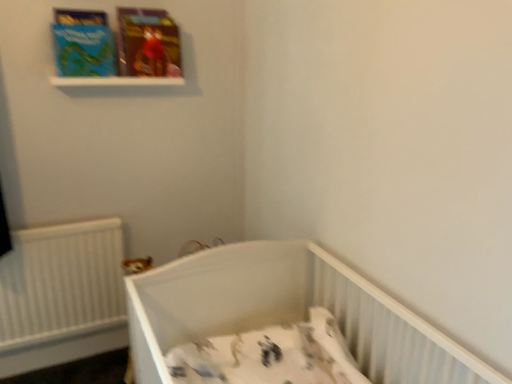
The image size is (512, 384). What do you see at coordinates (83, 43) in the screenshot?
I see `matte blue paperback book at upper left, which is counted as the 1th paperback book, starting from the left` at bounding box center [83, 43].

You are a GUI agent. You are given a task and a screenshot of the screen. Output one action in this format:
    pyautogui.click(x=<x>, y=<y>)
    Task: Click on the matte blue paperback book at upper left, which is counted as the 2th paperback book, starting from the right
    The width and height of the screenshot is (512, 384).
    Given the screenshot: What is the action you would take?
    pyautogui.click(x=83, y=43)

The image size is (512, 384). In order to click on white plastic crib at lower center in this screenshot , I will do `click(287, 312)`.

Image resolution: width=512 pixels, height=384 pixels. In order to click on matte blue paperback book at upper left, which is counted as the 2th paperback book, starting from the right in this screenshot , I will do `click(83, 43)`.

Which of these two, matte blue paperback book at upper left, which is counted as the 2th paperback book, starting from the right, or matte cardboard book at upper left, the 2th paperback book when ordered from left to right, is bigger?

With larger size is matte cardboard book at upper left, the 2th paperback book when ordered from left to right.

Between point (102, 25) and point (127, 26), which one is positioned in front?

The point (102, 25) is more forward.

Does matte blue paperback book at upper left, which is counted as the 1th paperback book, starting from the left, appear on the right side of matte cardboard book at upper left, the 2th paperback book when ordered from left to right?

No, matte blue paperback book at upper left, which is counted as the 1th paperback book, starting from the left, is not to the right of matte cardboard book at upper left, the 2th paperback book when ordered from left to right.

Which object is closer to the camera taking this photo, matte cardboard book at upper left, which ranks as the first paperback book in right-to-left order, or matte blue paperback book at upper left, which is counted as the 2th paperback book, starting from the right?

Positioned in front is matte blue paperback book at upper left, which is counted as the 2th paperback book, starting from the right.

In the scene shown: From the image's perspective, is matte cardboard book at upper left, the 2th paperback book when ordered from left to right, located above matte blue paperback book at upper left, which is counted as the 1th paperback book, starting from the left?

Yes, from the image's perspective, matte cardboard book at upper left, the 2th paperback book when ordered from left to right, is over matte blue paperback book at upper left, which is counted as the 1th paperback book, starting from the left.

Can you confirm if matte cardboard book at upper left, the 2th paperback book when ordered from left to right, is positioned to the right of matte blue paperback book at upper left, which is counted as the 2th paperback book, starting from the right?

Indeed, matte cardboard book at upper left, the 2th paperback book when ordered from left to right, is positioned on the right side of matte blue paperback book at upper left, which is counted as the 2th paperback book, starting from the right.

Considering the relative sizes of matte cardboard book at upper left, which ranks as the first paperback book in right-to-left order, and matte blue paperback book at upper left, which is counted as the 2th paperback book, starting from the right, in the image provided, is matte cardboard book at upper left, which ranks as the first paperback book in right-to-left order, wider than matte blue paperback book at upper left, which is counted as the 2th paperback book, starting from the right,?

Yes.

Does white plastic crib at lower center have a greater height compared to white plastic balustrade at upper center?

Indeed, white plastic crib at lower center has a greater height compared to white plastic balustrade at upper center.

Is there a large distance between white plastic crib at lower center and white plastic balustrade at upper center?

Yes, white plastic crib at lower center and white plastic balustrade at upper center are located far from each other.

From a real-world perspective, which is physically above, white plastic crib at lower center or white plastic balustrade at upper center?

white plastic balustrade at upper center.

Considering the relative sizes of white plastic balustrade at upper center and white plastic crib at lower center in the image provided, is white plastic balustrade at upper center bigger than white plastic crib at lower center?

Actually, white plastic balustrade at upper center might be smaller than white plastic crib at lower center.

Considering the sizes of objects white plastic balustrade at upper center and white plastic crib at lower center in the image provided, who is wider, white plastic balustrade at upper center or white plastic crib at lower center?

Wider between the two is white plastic crib at lower center.

Considering the relative positions of white plastic balustrade at upper center and white plastic crib at lower center in the image provided, is white plastic balustrade at upper center to the left of white plastic crib at lower center from the viewer's perspective?

Indeed, white plastic balustrade at upper center is positioned on the left side of white plastic crib at lower center.

Considering the positions of point (182, 83) and point (144, 19), is point (182, 83) closer or farther from the camera than point (144, 19)?

Point (182, 83) is positioned farther from the camera compared to point (144, 19).

In terms of size, does white plastic balustrade at upper center appear bigger or smaller than matte cardboard book at upper left, the 2th paperback book when ordered from left to right?

Considering their sizes, white plastic balustrade at upper center takes up less space than matte cardboard book at upper left, the 2th paperback book when ordered from left to right.

Which object is closer to the camera taking this photo, white plastic balustrade at upper center or matte cardboard book at upper left, which ranks as the first paperback book in right-to-left order?

white plastic balustrade at upper center is closer to the camera.

Consider the image. Does white plastic crib at lower center have a greater width compared to matte cardboard book at upper left, the 2th paperback book when ordered from left to right?

Correct, the width of white plastic crib at lower center exceeds that of matte cardboard book at upper left, the 2th paperback book when ordered from left to right.

Considering the sizes of objects white plastic crib at lower center and matte cardboard book at upper left, which ranks as the first paperback book in right-to-left order, in the image provided, who is smaller, white plastic crib at lower center or matte cardboard book at upper left, which ranks as the first paperback book in right-to-left order,?

matte cardboard book at upper left, which ranks as the first paperback book in right-to-left order.

Is white plastic crib at lower center facing away from matte cardboard book at upper left, which ranks as the first paperback book in right-to-left order?

No, white plastic crib at lower center's orientation is not away from matte cardboard book at upper left, which ranks as the first paperback book in right-to-left order.

From the image's perspective, is matte blue paperback book at upper left, which is counted as the 1th paperback book, starting from the left, beneath white plastic balustrade at upper center?

Incorrect, from the image's perspective, matte blue paperback book at upper left, which is counted as the 1th paperback book, starting from the left, is higher than white plastic balustrade at upper center.

Is matte blue paperback book at upper left, which is counted as the 1th paperback book, starting from the left, shorter than white plastic balustrade at upper center?

No, matte blue paperback book at upper left, which is counted as the 1th paperback book, starting from the left, is not shorter than white plastic balustrade at upper center.

Can you confirm if matte blue paperback book at upper left, which is counted as the 2th paperback book, starting from the right, is bigger than white plastic balustrade at upper center?

Yes.

Looking at this image, which point is more distant from viewer, (94, 54) or (95, 82)?

The point (95, 82) is behind.

At what (x,y) coordinates should I click in order to perform the action: click on paperback book in front of the matte cardboard book at upper left, the 2th paperback book when ordered from left to right. Please return your answer as a coordinate pair (x, y). This screenshot has height=384, width=512. Looking at the image, I should click on (83, 43).

In the image, there is a matte cardboard book at upper left, which ranks as the first paperback book in right-to-left order. Where is `paperback book below it (from a real-world perspective)`? Image resolution: width=512 pixels, height=384 pixels. paperback book below it (from a real-world perspective) is located at coordinates [x=83, y=43].

When comparing their distances from white plastic crib at lower center, does matte blue paperback book at upper left, which is counted as the 2th paperback book, starting from the right, or matte cardboard book at upper left, which ranks as the first paperback book in right-to-left order, seem further?

Based on the image, matte blue paperback book at upper left, which is counted as the 2th paperback book, starting from the right, appears to be further to white plastic crib at lower center.

From the image, which object appears to be farther from matte blue paperback book at upper left, which is counted as the 1th paperback book, starting from the left, white plastic crib at lower center or matte cardboard book at upper left, which ranks as the first paperback book in right-to-left order?

white plastic crib at lower center is further to matte blue paperback book at upper left, which is counted as the 1th paperback book, starting from the left.

When comparing their distances from matte blue paperback book at upper left, which is counted as the 2th paperback book, starting from the right, does matte cardboard book at upper left, the 2th paperback book when ordered from left to right, or white plastic balustrade at upper center seem further?

Based on the image, matte cardboard book at upper left, the 2th paperback book when ordered from left to right, appears to be further to matte blue paperback book at upper left, which is counted as the 2th paperback book, starting from the right.

When comparing their distances from white plastic balustrade at upper center, does white plastic crib at lower center or matte blue paperback book at upper left, which is counted as the 1th paperback book, starting from the left, seem closer?

matte blue paperback book at upper left, which is counted as the 1th paperback book, starting from the left, is positioned closer to the anchor white plastic balustrade at upper center.

When comparing their distances from white plastic crib at lower center, does matte blue paperback book at upper left, which is counted as the 2th paperback book, starting from the right, or white plastic balustrade at upper center seem further?

Among the two, matte blue paperback book at upper left, which is counted as the 2th paperback book, starting from the right, is located further to white plastic crib at lower center.

From the image, which object appears to be farther from white plastic balustrade at upper center, matte cardboard book at upper left, which ranks as the first paperback book in right-to-left order, or white plastic crib at lower center?

white plastic crib at lower center is positioned further to the anchor white plastic balustrade at upper center.

When comparing their distances from matte blue paperback book at upper left, which is counted as the 2th paperback book, starting from the right, does white plastic balustrade at upper center or white plastic crib at lower center seem closer?

Based on the image, white plastic balustrade at upper center appears to be nearer to matte blue paperback book at upper left, which is counted as the 2th paperback book, starting from the right.

Estimate the real-world distances between objects in this image. Which object is further from matte blue paperback book at upper left, which is counted as the 1th paperback book, starting from the left, white plastic balustrade at upper center or matte cardboard book at upper left, the 2th paperback book when ordered from left to right?

Among the two, matte cardboard book at upper left, the 2th paperback book when ordered from left to right, is located further to matte blue paperback book at upper left, which is counted as the 1th paperback book, starting from the left.

Find the location of a particular element. Image resolution: width=512 pixels, height=384 pixels. balustrade situated between matte blue paperback book at upper left, which is counted as the 1th paperback book, starting from the left, and matte cardboard book at upper left, the 2th paperback book when ordered from left to right, from left to right is located at coordinates (115, 81).

What are the coordinates of `balustrade between matte cardboard book at upper left, the 2th paperback book when ordered from left to right, and white plastic crib at lower center vertically` in the screenshot? It's located at (115, 81).

At what (x,y) coordinates should I click in order to perform the action: click on paperback book between matte cardboard book at upper left, which ranks as the first paperback book in right-to-left order, and white plastic crib at lower center in the up-down direction. Please return your answer as a coordinate pair (x, y). This screenshot has width=512, height=384. Looking at the image, I should click on (83, 43).

Identify the location of balustrade between matte blue paperback book at upper left, which is counted as the 1th paperback book, starting from the left, and white plastic crib at lower center vertically. (115, 81).